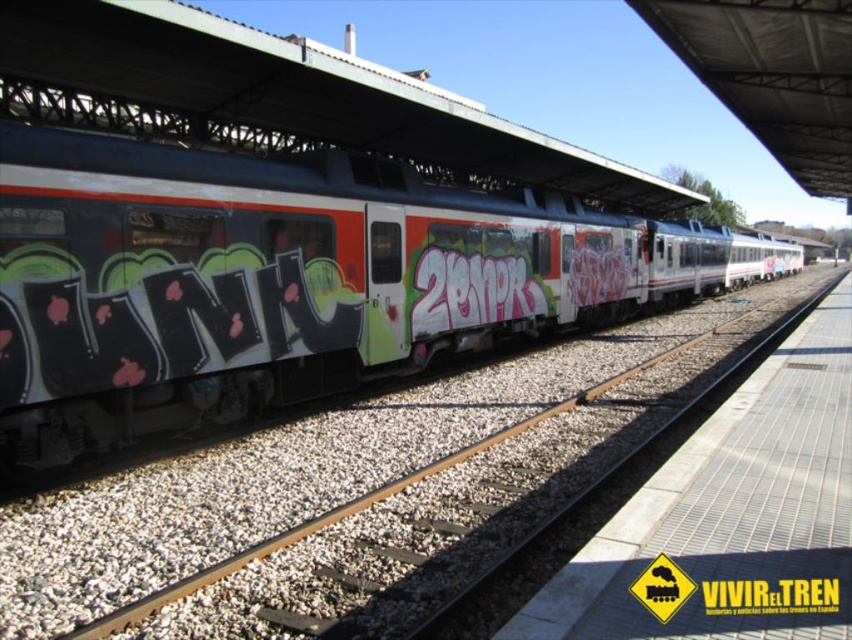
You are a maintenance worker who needs to walk from the metal grid platform at center to the smooth concrete train track at center. Which direction should you move to reach the track?

You should move to your left to reach the smooth concrete train track at center, since it is located to the left of the metal grid platform at center.

You are a maintenance worker needing to place a ladder against the matte black train at center and the metal grid platform at center. Since you can only choose one, which object should you place the ladder against and why?

You should place the ladder against the matte black train at center because it has a greater height compared to the metal grid platform at center, making it the better choice for reaching higher areas.

You are a photographer standing on the platform at the train station. You want to take a photo of the matte black train at center and the smooth concrete train track at center. Which object should you position to your left side to frame them properly?

You should position the smooth concrete train track at center to your left side because the matte black train at center is to the left of the smooth concrete train track at center, so aligning the track to your left will place the train on the right side of the frame for proper composition.